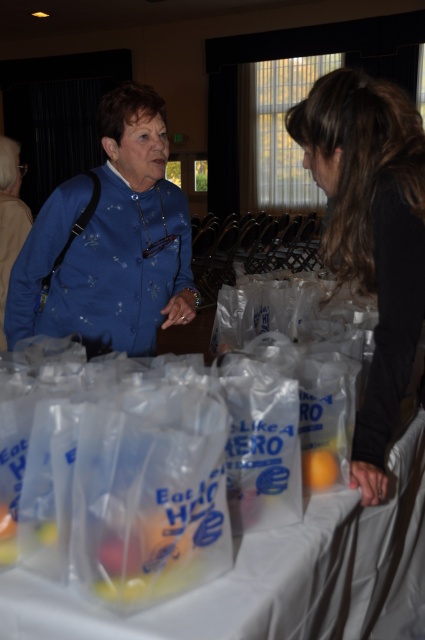
Between smooth black shirt at right and orange matte/orange at center, which one has less height?

Standing shorter between the two is orange matte/orange at center.

Can you confirm if smooth black shirt at right is thinner than orange matte/orange at center?

No.

What are the coordinates of `smooth black shirt at right` in the screenshot? It's located at (371, 234).

Which is behind, point (325, 237) or point (22, 202)?

Point (22, 202)

Between smooth black shirt at right and blue satin blouse at upper left, which one appears on the left side from the viewer's perspective?

blue satin blouse at upper left

Is point (393, 339) closer to camera compared to point (17, 172)?

That is True.

Where is `smooth black shirt at right`? Image resolution: width=425 pixels, height=640 pixels. smooth black shirt at right is located at coordinates (371, 234).

Does matte blue blouse at center appear on the right side of orange matte/orange at center?

Incorrect, matte blue blouse at center is not on the right side of orange matte/orange at center.

In the scene shown: Does matte blue blouse at center have a smaller size compared to orange matte/orange at center?

No.

Describe the element at coordinates (110, 241) in the screenshot. I see `matte blue blouse at center` at that location.

You are a GUI agent. You are given a task and a screenshot of the screen. Output one action in this format:
    pyautogui.click(x=<x>, y=<y>)
    Task: Click on the matte blue blouse at center
    The image size is (425, 640).
    Given the screenshot: What is the action you would take?
    pyautogui.click(x=110, y=241)